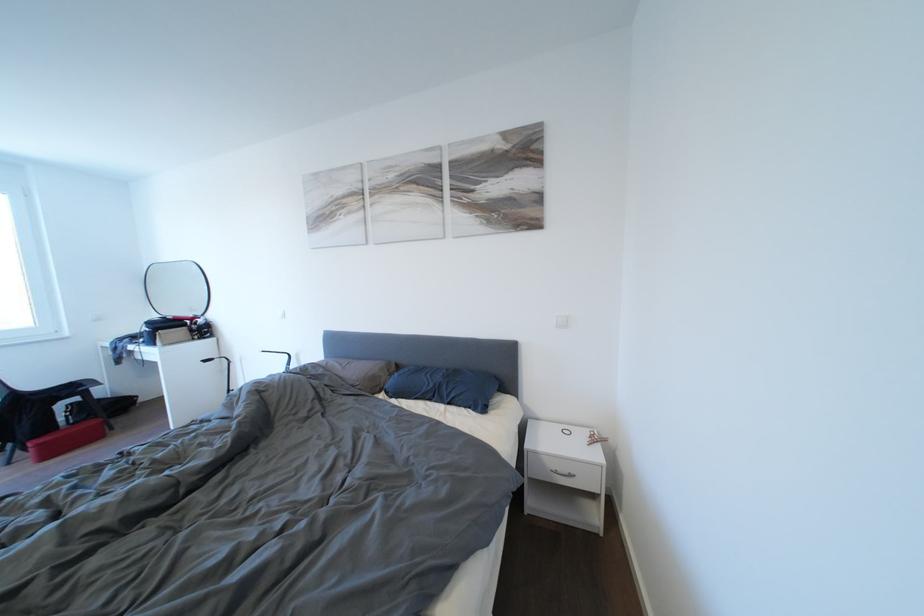
Where would you pull the silver drawer handle? Please return your answer as a coordinate pair (x, y).

(563, 474)